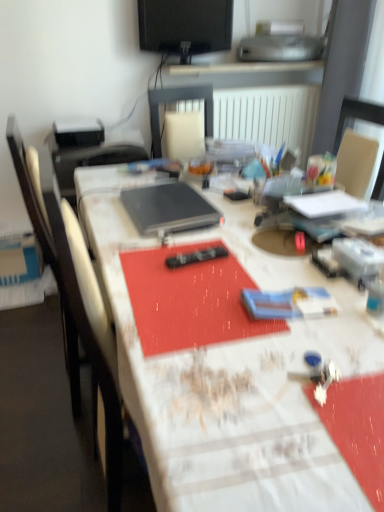
The width and height of the screenshot is (384, 512). What do you see at coordinates (168, 208) in the screenshot?
I see `black matte laptop at center` at bounding box center [168, 208].

Describe the element at coordinates (281, 48) in the screenshot. I see `silver metallic printer at upper center` at that location.

You are a GUI agent. You are given a task and a screenshot of the screen. Output one action in this format:
    pyautogui.click(x=<x>, y=<y>)
    Task: Click on the black glossy monitor at upper center
    This screenshot has height=512, width=384.
    Given the screenshot: What is the action you would take?
    pyautogui.click(x=185, y=26)

Is silver metallic printer at upper center touching black plastic remote control at center?

No, silver metallic printer at upper center is not next to black plastic remote control at center.

Looking at this image, can you tell me how much silver metallic printer at upper center and black plastic remote control at center differ in facing direction?

The angle between the facing direction of silver metallic printer at upper center and the facing direction of black plastic remote control at center is 83.2 degrees.

You are a GUI agent. You are given a task and a screenshot of the screen. Output one action in this format:
    pyautogui.click(x=<x>, y=<y>)
    Task: Click on the remote control that is on the left side of silver metallic printer at upper center
    
    Given the screenshot: What is the action you would take?
    pyautogui.click(x=195, y=257)

Is silver metallic printer at upper center facing towards black plastic remote control at center?

→ No, silver metallic printer at upper center is not aimed at black plastic remote control at center.

Looking at this image, is white textured table at center taller than black glossy monitor at upper center?

Correct, white textured table at center is much taller as black glossy monitor at upper center.

Consider the image. From a real-world perspective, who is located lower, white textured table at center or black glossy monitor at upper center?

From a 3D spatial view, white textured table at center is below.

Is white textured table at center positioned beyond the bounds of black glossy monitor at upper center?

Absolutely, white textured table at center is external to black glossy monitor at upper center.

Consider the image. Is white textured table at center bigger or smaller than black glossy monitor at upper center?

→ In the image, white textured table at center appears to be larger than black glossy monitor at upper center.

Looking at the image, does black glossy monitor at upper center seem bigger or smaller compared to black plastic remote control at center?

Considering their sizes, black glossy monitor at upper center takes up more space than black plastic remote control at center.

Does black glossy monitor at upper center have a greater width compared to black plastic remote control at center?

No, black glossy monitor at upper center is not wider than black plastic remote control at center.

Identify the location of television located on the left of black plastic remote control at center. This screenshot has height=512, width=384. (185, 26).

Is black plastic remote control at center located within black glossy monitor at upper center?

No, black plastic remote control at center is located outside of black glossy monitor at upper center.

Which object is closer to the camera taking this photo, black glossy monitor at upper center or silver metallic printer at upper center?

Positioned in front is black glossy monitor at upper center.

Is silver metallic printer at upper center a part of black glossy monitor at upper center?

No, black glossy monitor at upper center does not contain silver metallic printer at upper center.

Identify the location of printer above the black glossy monitor at upper center (from the image's perspective). (281, 48).

Looking at this image, considering the relative sizes of black glossy monitor at upper center and silver metallic printer at upper center in the image provided, is black glossy monitor at upper center bigger than silver metallic printer at upper center?

No.

Looking at this image, is white textured table at center beside black matte laptop at center?

No, white textured table at center is not beside black matte laptop at center.

Is white textured table at center spatially inside black matte laptop at center, or outside of it?

white textured table at center is outside black matte laptop at center.

Where is `desk in front of the black matte laptop at center`? This screenshot has width=384, height=512. desk in front of the black matte laptop at center is located at coordinates (230, 375).

Who is more distant, white textured table at center or black matte laptop at center?

black matte laptop at center is behind.

From a real-world perspective, is black matte laptop at center physically below silver metallic printer at upper center?

Yes, from a real-world perspective, black matte laptop at center is beneath silver metallic printer at upper center.

In the image, is black matte laptop at center positioned in front of or behind silver metallic printer at upper center?

In the image, black matte laptop at center appears in front of silver metallic printer at upper center.

Is silver metallic printer at upper center located within black matte laptop at center?

No.

From the picture: How many degrees apart are the facing directions of black matte laptop at center and silver metallic printer at upper center?

87.3 degrees.

Are silver metallic printer at upper center and black matte laptop at center located far from each other?

A: Yes, silver metallic printer at upper center and black matte laptop at center are quite far apart.

Who is shorter, silver metallic printer at upper center or black matte laptop at center?

With less height is black matte laptop at center.

Locate an element on the screen. The image size is (384, 512). laptop below the silver metallic printer at upper center (from the image's perspective) is located at coordinates (168, 208).

From a real-world perspective, which object stands above the other?

silver metallic printer at upper center, from a real-world perspective.

The image size is (384, 512). I want to click on remote control on the left of silver metallic printer at upper center, so click(x=195, y=257).

This screenshot has width=384, height=512. Identify the location of television that appears above the white textured table at center (from a real-world perspective). (185, 26).

Which object lies further to the anchor point silver metallic printer at upper center, black plastic remote control at center or white textured table at center?

The object further to silver metallic printer at upper center is white textured table at center.

From the image, which object appears to be farther from black glossy monitor at upper center, white textured table at center or black matte laptop at center?

The object further to black glossy monitor at upper center is white textured table at center.

Looking at this image, which object lies further to the anchor point silver metallic printer at upper center, black glossy monitor at upper center or black matte laptop at center?

black matte laptop at center.

Based on the photo, estimate the real-world distances between objects in this image. Which object is further from silver metallic printer at upper center, black matte laptop at center or white textured table at center?

white textured table at center.

Considering their positions, is black matte laptop at center positioned closer to black plastic remote control at center than black glossy monitor at upper center?

black matte laptop at center lies closer to black plastic remote control at center than the other object.

From the image, which object appears to be nearer to black plastic remote control at center, black glossy monitor at upper center or black matte laptop at center?

black matte laptop at center is closer to black plastic remote control at center.

Looking at the image, which one is located closer to silver metallic printer at upper center, black glossy monitor at upper center or white textured table at center?

black glossy monitor at upper center lies closer to silver metallic printer at upper center than the other object.

From the image, which object appears to be nearer to silver metallic printer at upper center, black plastic remote control at center or black glossy monitor at upper center?

black glossy monitor at upper center.

Locate an element on the screen. remote control positioned between white textured table at center and black matte laptop at center from near to far is located at coordinates (195, 257).

Image resolution: width=384 pixels, height=512 pixels. In order to click on remote control positioned between white textured table at center and black glossy monitor at upper center from near to far in this screenshot , I will do `click(195, 257)`.

Where is `laptop that lies between silver metallic printer at upper center and black plastic remote control at center from top to bottom`? The height and width of the screenshot is (512, 384). laptop that lies between silver metallic printer at upper center and black plastic remote control at center from top to bottom is located at coordinates (168, 208).

Find the location of a particular element. This screenshot has width=384, height=512. laptop between black glossy monitor at upper center and black plastic remote control at center in the vertical direction is located at coordinates (168, 208).